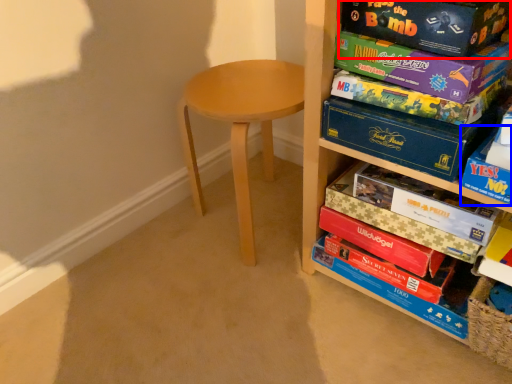
Question: Which of the following is the farthest to the observer, paperback book (highlighted by a red box) or storage box (highlighted by a blue box)?

Choices:
 (A) paperback book
 (B) storage box

Answer: (A)